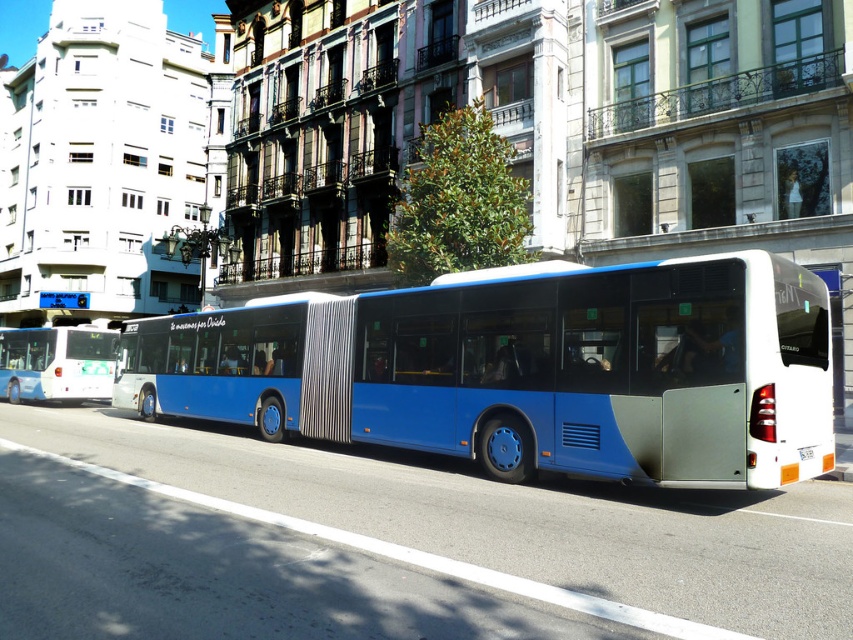
Looking at this image, which is above, blue metallic bus at center or white glossy bus at left?

blue metallic bus at center is higher up.

Which is in front, point (503, 452) or point (33, 348)?

Point (503, 452) is in front.

What are the coordinates of `blue metallic bus at center` in the screenshot? It's located at (525, 369).